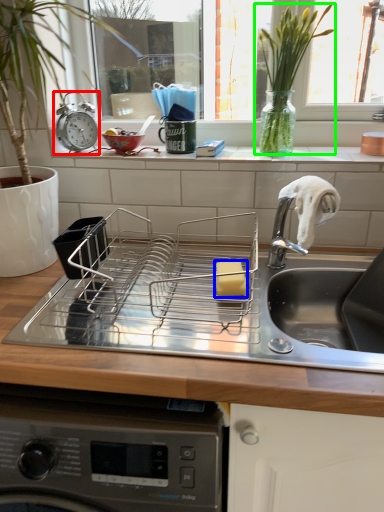
Question: Which is farther away from alarm clock (highlighted by a red box)? food (highlighted by a blue box) or plant (highlighted by a green box)?

Choices:
 (A) food
 (B) plant

Answer: (A)